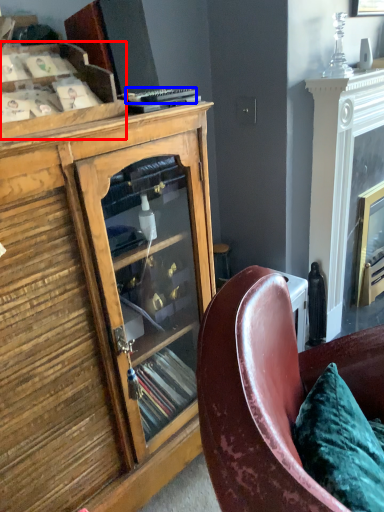
Question: Which point is further to the camera, shelf (highlighted by a red box) or remote control (highlighted by a blue box)?

Choices:
 (A) shelf
 (B) remote control

Answer: (B)